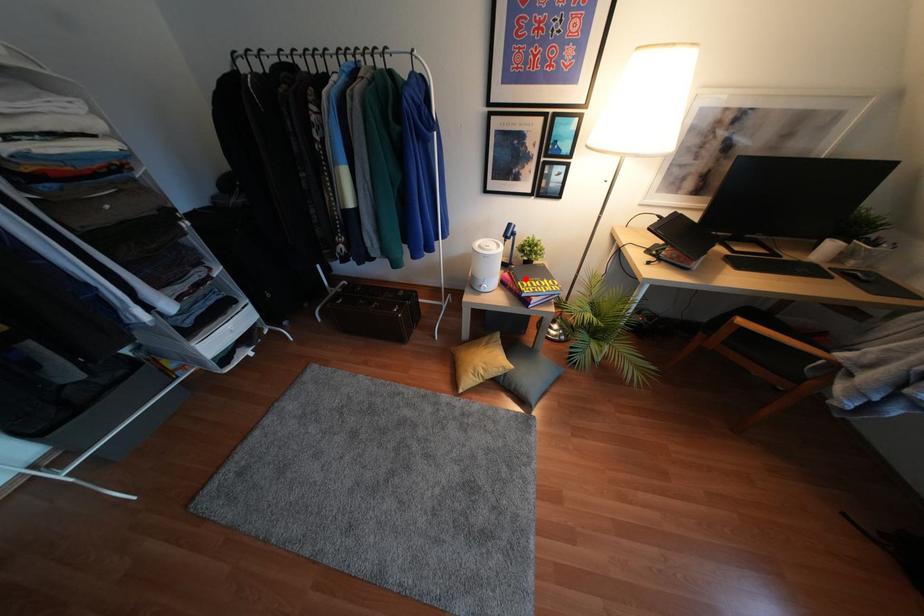
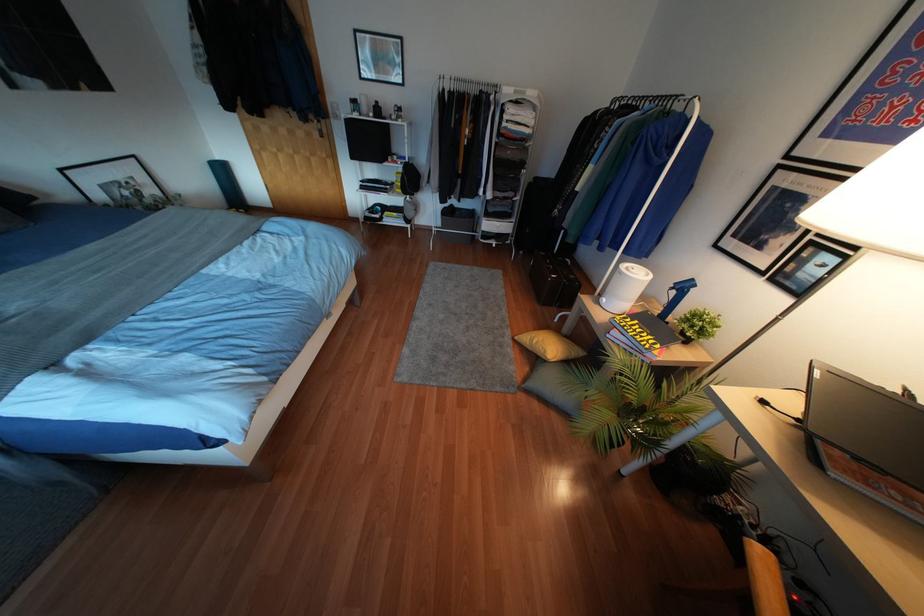
The point at the highlighted location is marked in the first image. Where is the corresponding point in the second image?

(637, 321)